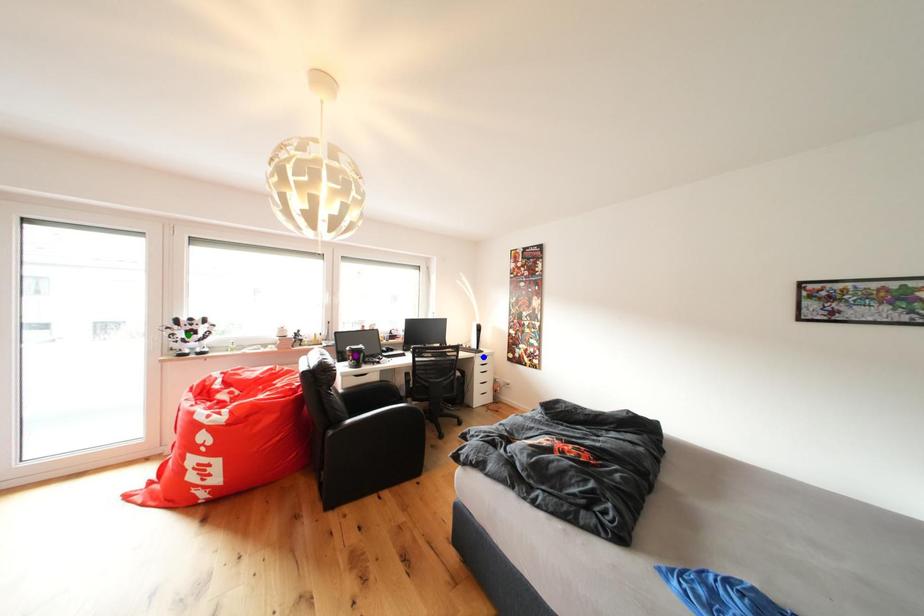
Order these from nearest to farthest:
green point, blue point, purple point

blue point → purple point → green point